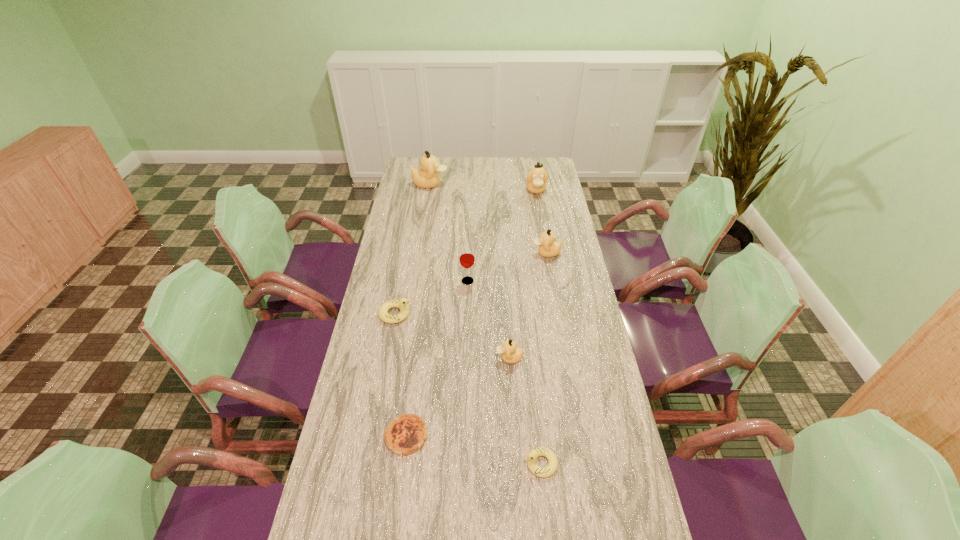
Identify the location of object that is at the far left corner. (427, 177).

In order to click on free spot at the left edge of the desktop in this screenshot , I will do `click(393, 245)`.

Locate an element on the screen. This screenshot has width=960, height=540. vacant space at the right edge is located at coordinates (559, 231).

Locate an element on the screen. vacant space at the far left corner of the desktop is located at coordinates (418, 164).

In the image, there is a desktop. Where is `free region at the far right corner`? The image size is (960, 540). free region at the far right corner is located at coordinates (545, 164).

Where is `unoccupied position between the smallest tan duckling and the second nearest tan duckling`? This screenshot has width=960, height=540. unoccupied position between the smallest tan duckling and the second nearest tan duckling is located at coordinates (528, 306).

Find the location of `empty space between the second nearest duckling and the second biggest tan duckling`. empty space between the second nearest duckling and the second biggest tan duckling is located at coordinates (522, 274).

The image size is (960, 540). What are the coordinates of `free space between the smallest tan duckling and the second biggest tan duckling` in the screenshot? It's located at (522, 274).

Locate an element on the screen. free space between the leftmost tan duckling and the shortest duckling is located at coordinates (486, 323).

Where is `free space between the second tallest duckling and the tallest duckling`? The image size is (960, 540). free space between the second tallest duckling and the tallest duckling is located at coordinates (483, 187).